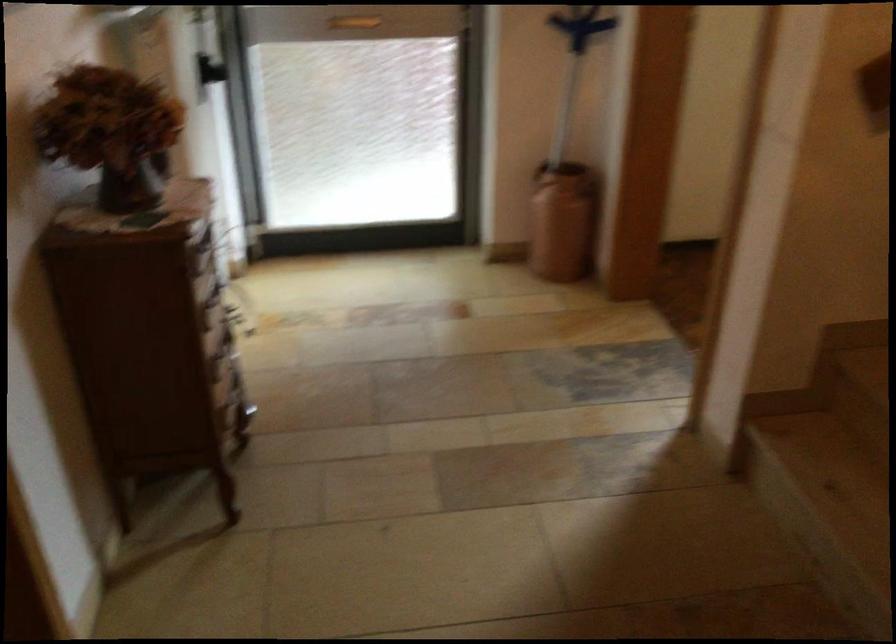
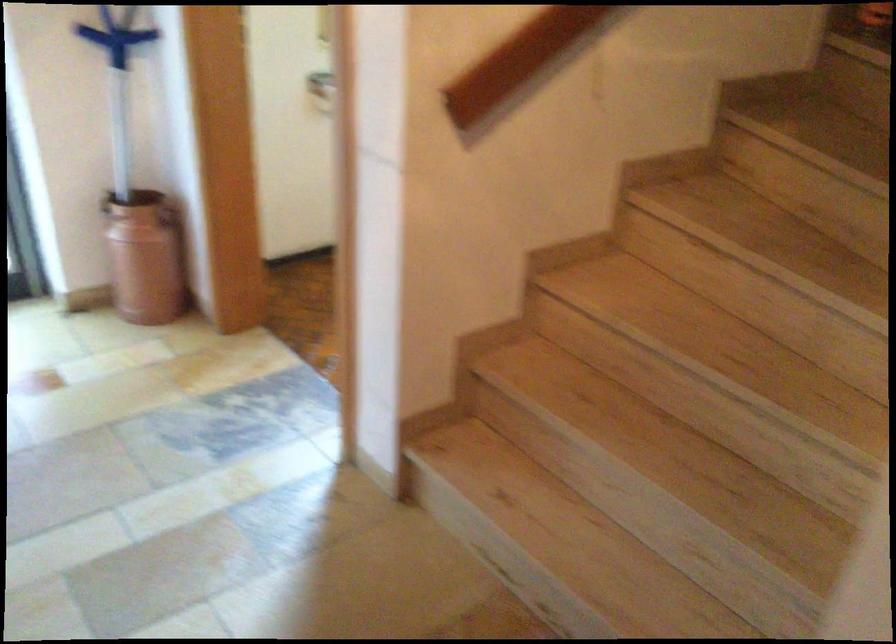
Find the pixel in the second image that matches point 582,187 in the first image.

(168, 216)